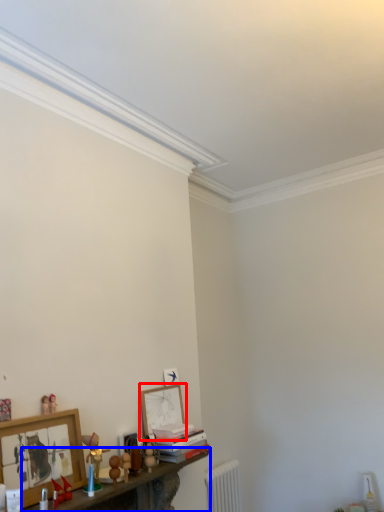
Question: Which object is closer to the camera taking this photo, picture frame (highlighted by a red box) or shelf (highlighted by a blue box)?

Choices:
 (A) picture frame
 (B) shelf

Answer: (B)